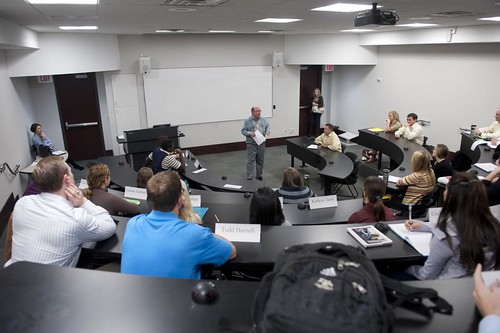
Image resolution: width=500 pixels, height=333 pixels. I want to click on light, so click(86, 0), click(86, 27), click(164, 31), click(212, 31), click(281, 19), click(266, 31), click(338, 7), click(419, 24), click(361, 30), click(494, 18).